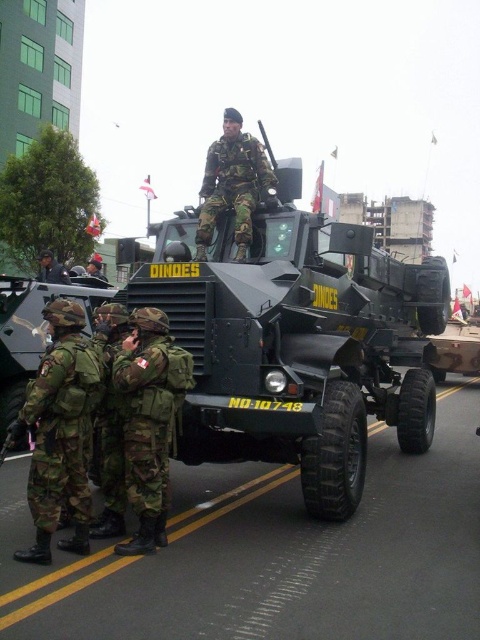
Is matte black armored vehicle at center smaller than camouflage uniform at center?

No.

In the scene shown: Measure the distance between matte black armored vehicle at center and camouflage uniform at center.

A distance of 23.23 feet exists between matte black armored vehicle at center and camouflage uniform at center.

Measure the distance between matte black armored vehicle at center and camera.

A distance of 4.39 meters exists between matte black armored vehicle at center and camera.

You are a GUI agent. You are given a task and a screenshot of the screen. Output one action in this format:
    pyautogui.click(x=<x>, y=<y>)
    Task: Click on the matte black armored vehicle at center
    This screenshot has width=480, height=640.
    Given the screenshot: What is the action you would take?
    point(296,342)

Based on the photo, which is more to the right, green matte armored vehicle at center or camouflage uniform at center?

Positioned to the right is green matte armored vehicle at center.

Does point (43, 346) come farther from viewer compared to point (94, 276)?

No, (43, 346) is closer to viewer.

The width and height of the screenshot is (480, 640). Identify the location of green matte armored vehicle at center. (33, 332).

Is camouflage fabric uniform at left closer to camera compared to matte black helmet at center?

Yes, it is.

Which is more to the right, camouflage fabric uniform at left or matte black helmet at center?

Positioned to the right is camouflage fabric uniform at left.

The image size is (480, 640). Describe the element at coordinates (60, 432) in the screenshot. I see `camouflage fabric uniform at left` at that location.

This screenshot has width=480, height=640. In order to click on camouflage fabric uniform at left in this screenshot , I will do tap(60, 432).